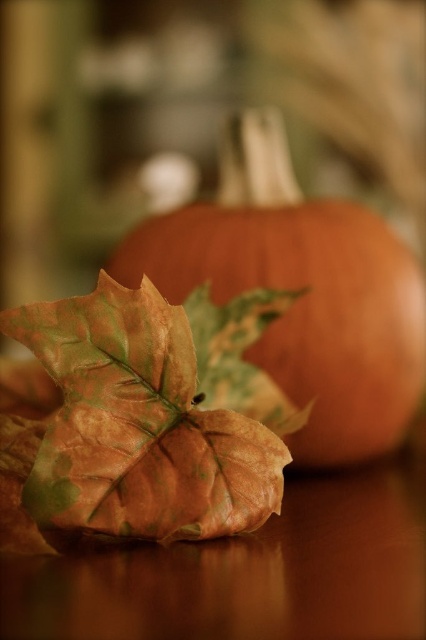
Between leathery brown leaf at lower left and matte orange pumpkin at center, which one is positioned higher?

Positioned higher is matte orange pumpkin at center.

Can you confirm if leathery brown leaf at lower left is bigger than matte orange pumpkin at center?

Actually, leathery brown leaf at lower left might be smaller than matte orange pumpkin at center.

Identify the location of leathery brown leaf at lower left. The height and width of the screenshot is (640, 426). click(146, 419).

Image resolution: width=426 pixels, height=640 pixels. I want to click on leathery brown leaf at lower left, so click(146, 419).